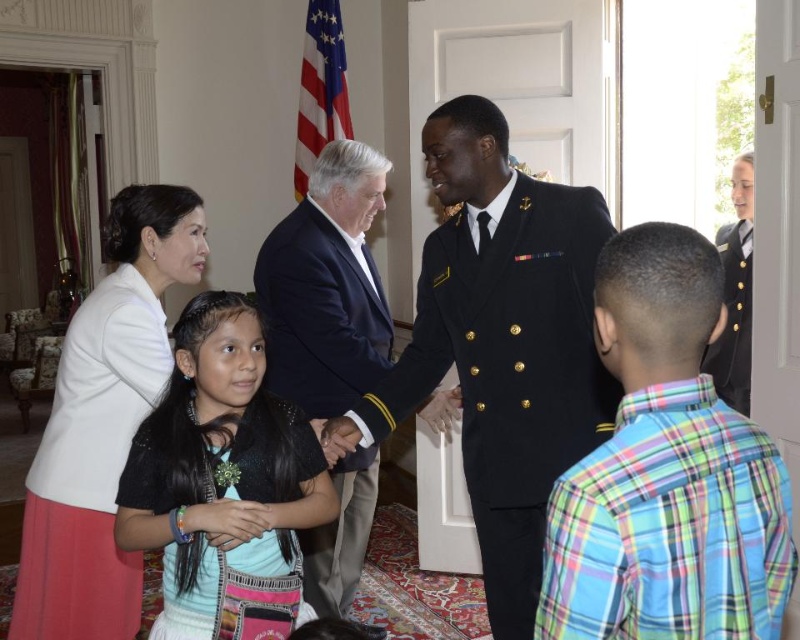
Question: Which object appears farthest from the camera in this image?

Choices:
 (A) dark blue suit at center
 (B) plaid cotton shirt at lower right
 (C) black textured dress at center

Answer: (A)

Question: Among these points, which one is nearest to the camera?

Choices:
 (A) (745, 371)
 (B) (240, 360)
 (C) (450, 200)

Answer: (B)

Question: In this image, where is shiny black uniform at center located relative to plaid cotton shirt at lower right?

Choices:
 (A) above
 (B) below

Answer: (A)

Question: Which of the following is the farthest from the observer?

Choices:
 (A) black textured dress at center
 (B) dark blue suit at center
 (C) shiny black uniform at center
 (D) shiny gold buttons at right

Answer: (D)

Question: Observing the image, what is the correct spatial positioning of plaid cotton shirt at lower right in reference to dark blue suit at center?

Choices:
 (A) above
 (B) below

Answer: (A)

Question: Is shiny black uniform at center smaller than dark blue suit at center?

Choices:
 (A) no
 (B) yes

Answer: (B)